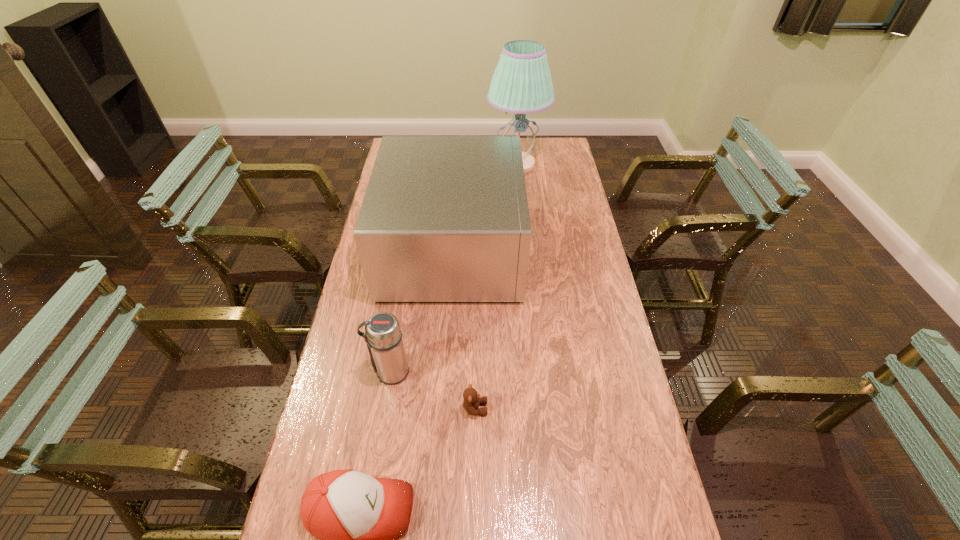
You are a GUI agent. You are given a task and a screenshot of the screen. Output one action in this format:
    pyautogui.click(x=<x>, y=<y>)
    Task: Click on the vacant area situated on the face of the teddy bear
    
    Given the screenshot: What is the action you would take?
    pyautogui.click(x=574, y=408)

Identify the location of object that is at the far edge. The height and width of the screenshot is (540, 960). (521, 84).

This screenshot has height=540, width=960. I want to click on microwave oven that is at the left edge, so click(444, 218).

At what (x,y) coordinates should I click in order to perform the action: click on thermos bottle that is positioned at the left edge. Please return your answer as a coordinate pair (x, y). Image resolution: width=960 pixels, height=540 pixels. Looking at the image, I should click on (383, 336).

What are the coordinates of `object that is at the right edge` in the screenshot? It's located at (521, 84).

Identify the location of object that is at the far right corner. The image size is (960, 540). (521, 84).

Image resolution: width=960 pixels, height=540 pixels. What are the coordinates of `vacant space at the far edge of the desktop` in the screenshot? It's located at (532, 152).

Identify the location of free region at the right edge of the desktop. (553, 184).

This screenshot has width=960, height=540. I want to click on free space between the third farthest object and the second tallest object, so click(x=421, y=310).

Where is `free space between the third farthest object and the second tallest object`? The image size is (960, 540). free space between the third farthest object and the second tallest object is located at coordinates pyautogui.click(x=421, y=310).